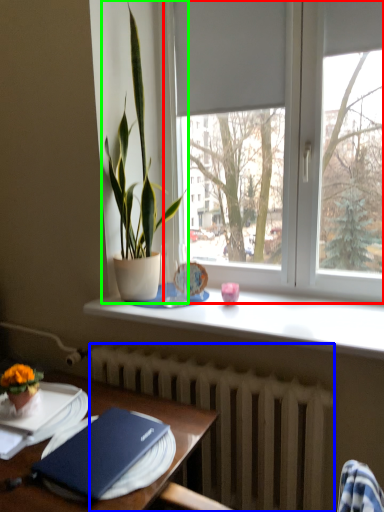
Question: Estimate the real-world distances between objects in this image. Which object is farther from window (highlighted by a red box), radiator (highlighted by a blue box) or houseplant (highlighted by a green box)?

Choices:
 (A) radiator
 (B) houseplant

Answer: (A)